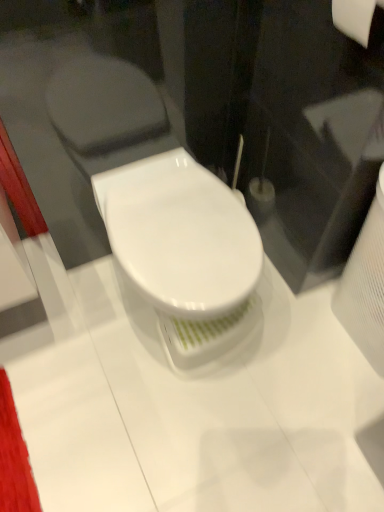
Identify the location of free space above white glossy toilet at center (from a real-world perspective). (177, 222).